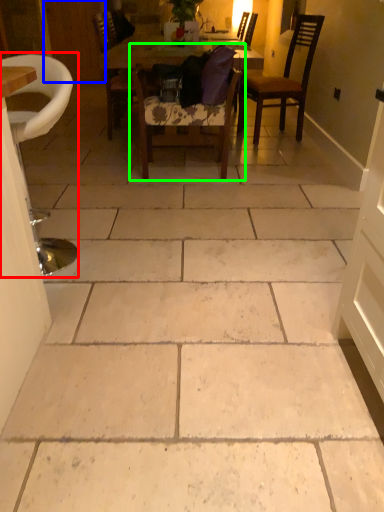
Question: Considering the real-world distances, which object is closest to chair (highlighted by a red box)? door (highlighted by a blue box) or chair (highlighted by a green box).

Choices:
 (A) door
 (B) chair

Answer: (B)